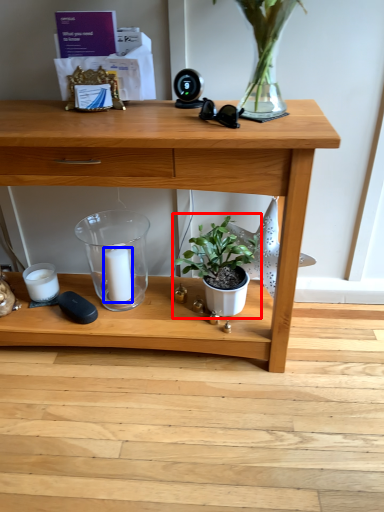
Question: Which object is closer to the camera taking this photo, houseplant (highlighted by a red box) or candle (highlighted by a blue box)?

Choices:
 (A) houseplant
 (B) candle

Answer: (A)